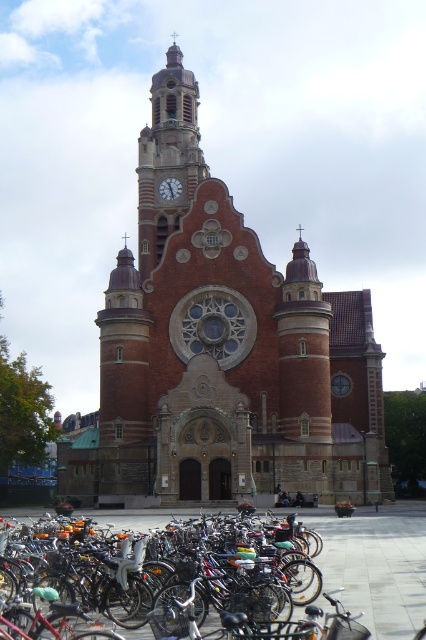
Consider the image. You are standing in front of the grand church and want to take a photo of the shiny metallic bicycle at lower left. Where should you position yourself to ensure the bicycle is centered in your camera frame?

To center the shiny metallic bicycle at lower left in your camera frame, position yourself directly in front of the point at coordinates (175, 584) where the bicycle is located.

You are a delivery person who needs to park your shiny metallic bicycle at lower left near the brick clock tower at center. The parking area has a width restriction of 1.2 meters. Can you park your bicycle there without exceeding the width limit?

The shiny metallic bicycle at lower left might be wider than the brick clock tower at center, but the width of the bicycle itself isn not specified. Therefore, it is uncertain whether it will fit within the 1.2 meter restriction. Check the bicycle dimensions before parking.

You are standing in front of the church and see the shiny metallic bicycle at lower left and the matte red clock at upper center. Which object is positioned to the right of the other?

The shiny metallic bicycle at lower left is to the right of the matte red clock at upper center.